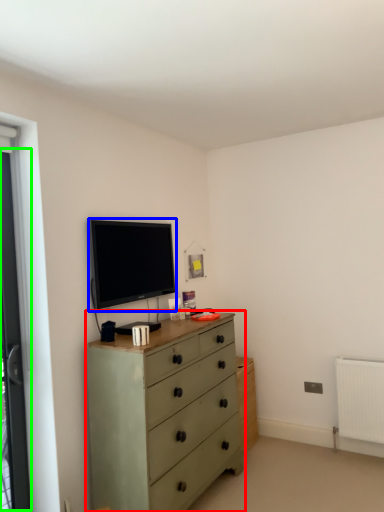
Question: Based on their relative distances, which object is farther from chest of drawers (highlighted by a red box)? Choose from television (highlighted by a blue box) and screen door (highlighted by a green box).

Choices:
 (A) television
 (B) screen door

Answer: (B)